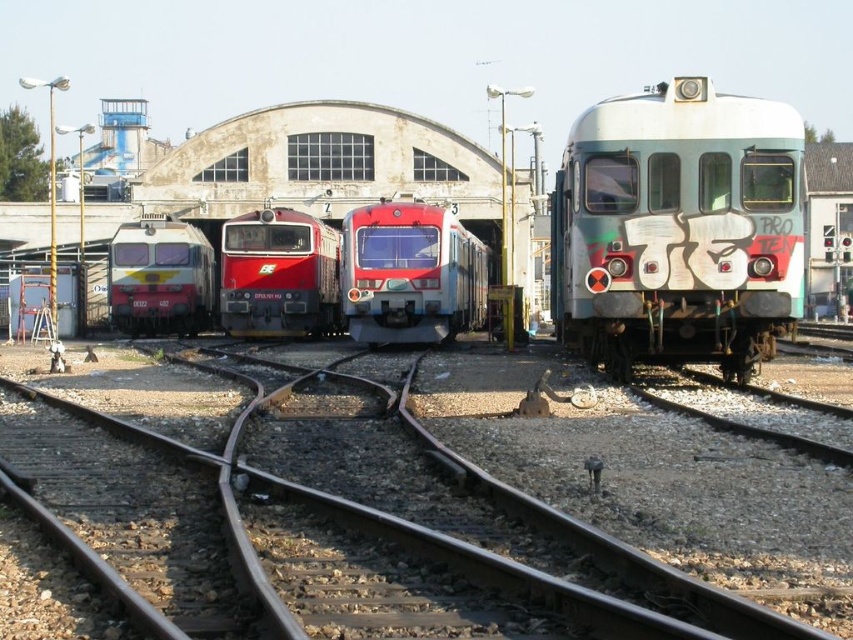
You are a maintenance worker needing to inspect both the smooth red train at center and the matte red train at center. Given that your inspection tool has a maximum reach of 4 meters, can you inspect both trains without moving closer?

The smooth red train at center and the matte red train at center are 4.15 meters apart from each other, so the tool with a maximum reach of 4 meters cannot cover the distance between them. You will need to move closer to inspect both trains.

You are a railway worker standing at the junction. You need to move the white matte train at center and the smooth red train at center to separate tracks. Which direction should you move each train to ensure they are on tracks that don not intersect?

Move the white matte train at center to the right and the smooth red train at center to the left. Since the white matte train at center is already to the right of the smooth red train at center, moving them in opposite directions will place them on non intersecting tracks.

You are a railway inspector checking the space between the metal at center and the matte red train at center. Which object takes up more space in the scene?

The matte red train at center occupies more space than the metal at center, as the metal at center occupies less space than matte red train at center.